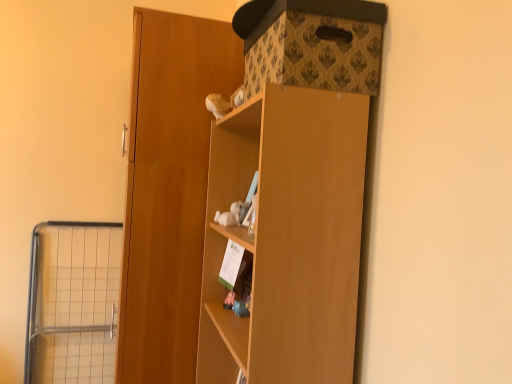
What is the approximate width of wooden door at center?

22.06 inches.

What do you see at coordinates (72, 302) in the screenshot? Image resolution: width=512 pixels, height=384 pixels. I see `metal wire cage at left` at bounding box center [72, 302].

At what (x,y) coordinates should I click in order to perform the action: click on wooden door at center. Please return your answer as a coordinate pair (x, y). The height and width of the screenshot is (384, 512). Looking at the image, I should click on (x=169, y=190).

Between wooden door at center and metal wire cage at left, which one has more height?

Standing taller between the two is wooden door at center.

Are wooden door at center and metal wire cage at left far apart?

They are positioned close to each other.

Is wooden door at center positioned with its back to metal wire cage at left?

wooden door at center is not turned away from metal wire cage at left.

Which is more to the right, wooden door at center or metal wire cage at left?

Positioned to the right is wooden door at center.

Is patterned cardboard storage box at upper right far from wooden cupboard at center?

That's not correct — patterned cardboard storage box at upper right is a little close to wooden cupboard at center.

Between patterned cardboard storage box at upper right and wooden cupboard at center, which one has larger size?

wooden cupboard at center.

This screenshot has width=512, height=384. I want to click on storage box behind the wooden cupboard at center, so click(x=312, y=44).

In the image, is patterned cardboard storage box at upper right positioned in front of or behind wooden cupboard at center?

patterned cardboard storage box at upper right is positioned farther from the viewer than wooden cupboard at center.

Is point (30, 318) farther from viewer compared to point (334, 225)?

Yes.

How many degrees apart are the facing directions of metal wire cage at left and wooden cupboard at center?

There is a 89.9-degree angle between the facing directions of metal wire cage at left and wooden cupboard at center.

Which is more to the left, metal wire cage at left or wooden cupboard at center?

Positioned to the left is metal wire cage at left.

From a real-world perspective, is metal wire cage at left on top of wooden cupboard at center?

Incorrect, from a real-world perspective, metal wire cage at left is lower than wooden cupboard at center.

Is metal wire cage at left completely or partially outside of patterned cardboard storage box at upper right?

metal wire cage at left lies outside patterned cardboard storage box at upper right's area.

How different are the orientations of metal wire cage at left and patterned cardboard storage box at upper right in degrees?

They differ by 91.2 degrees in their facing directions.

Is metal wire cage at left oriented away from patterned cardboard storage box at upper right?

metal wire cage at left is not turned away from patterned cardboard storage box at upper right.

From a real-world perspective, who is located lower, metal wire cage at left or patterned cardboard storage box at upper right?

metal wire cage at left.

Locate an element on the screen. The height and width of the screenshot is (384, 512). cupboard in front of the metal wire cage at left is located at coordinates (287, 237).

Is wooden cupboard at center facing towards metal wire cage at left?

No, wooden cupboard at center is not aimed at metal wire cage at left.

From a real-world perspective, is wooden cupboard at center physically located above or below metal wire cage at left?

wooden cupboard at center is above metal wire cage at left.

Is wooden door at center positioned with its back to patterned cardboard storage box at upper right?

That's not correct — wooden door at center is not looking away from patterned cardboard storage box at upper right.

Based on the photo, considering the relative sizes of wooden door at center and patterned cardboard storage box at upper right in the image provided, is wooden door at center wider than patterned cardboard storage box at upper right?

Indeed, wooden door at center has a greater width compared to patterned cardboard storage box at upper right.

Is wooden door at center inside or outside of patterned cardboard storage box at upper right?

wooden door at center is not enclosed by patterned cardboard storage box at upper right.

Identify the location of storage box above the wooden door at center (from a real-world perspective). Image resolution: width=512 pixels, height=384 pixels. (312, 44).

Considering the relative sizes of patterned cardboard storage box at upper right and metal wire cage at left in the image provided, is patterned cardboard storage box at upper right shorter than metal wire cage at left?

Correct, patterned cardboard storage box at upper right is not as tall as metal wire cage at left.

Where is `cage on the left of patterned cardboard storage box at upper right`? Image resolution: width=512 pixels, height=384 pixels. cage on the left of patterned cardboard storage box at upper right is located at coordinates (72, 302).

Is patterned cardboard storage box at upper right looking in the opposite direction of metal wire cage at left?

patterned cardboard storage box at upper right is not turned away from metal wire cage at left.

Locate an element on the screen. door lying in front of the metal wire cage at left is located at coordinates (169, 190).

Locate an element on the screen. cupboard located below the patterned cardboard storage box at upper right (from the image's perspective) is located at coordinates (287, 237).

Considering their positions, is wooden door at center positioned further to patterned cardboard storage box at upper right than wooden cupboard at center?

wooden door at center.

Estimate the real-world distances between objects in this image. Which object is closer to wooden cupboard at center, metal wire cage at left or wooden door at center?

wooden door at center lies closer to wooden cupboard at center than the other object.

From the image, which object appears to be farther from metal wire cage at left, wooden door at center or patterned cardboard storage box at upper right?

Based on the image, patterned cardboard storage box at upper right appears to be further to metal wire cage at left.

Based on their spatial positions, is patterned cardboard storage box at upper right or wooden door at center closer to metal wire cage at left?

Answer: wooden door at center is positioned closer to the anchor metal wire cage at left.

Considering their positions, is patterned cardboard storage box at upper right positioned closer to wooden cupboard at center than wooden door at center?

Based on the image, patterned cardboard storage box at upper right appears to be nearer to wooden cupboard at center.

Based on their spatial positions, is metal wire cage at left or wooden cupboard at center closer to wooden door at center?

The object closer to wooden door at center is wooden cupboard at center.

Which object lies nearer to the anchor point wooden door at center, patterned cardboard storage box at upper right or metal wire cage at left?

Based on the image, patterned cardboard storage box at upper right appears to be nearer to wooden door at center.

From the image, which object appears to be farther from metal wire cage at left, wooden door at center or wooden cupboard at center?

wooden cupboard at center lies further to metal wire cage at left than the other object.

The width and height of the screenshot is (512, 384). What are the coordinates of `storage box positioned between wooden cupboard at center and metal wire cage at left from near to far` in the screenshot? It's located at click(x=312, y=44).

Identify the location of door between patterned cardboard storage box at upper right and wooden cupboard at center in the vertical direction. (169, 190).

The width and height of the screenshot is (512, 384). Identify the location of door positioned between patterned cardboard storage box at upper right and metal wire cage at left from near to far. (169, 190).

I want to click on door positioned between wooden cupboard at center and metal wire cage at left from near to far, so click(x=169, y=190).